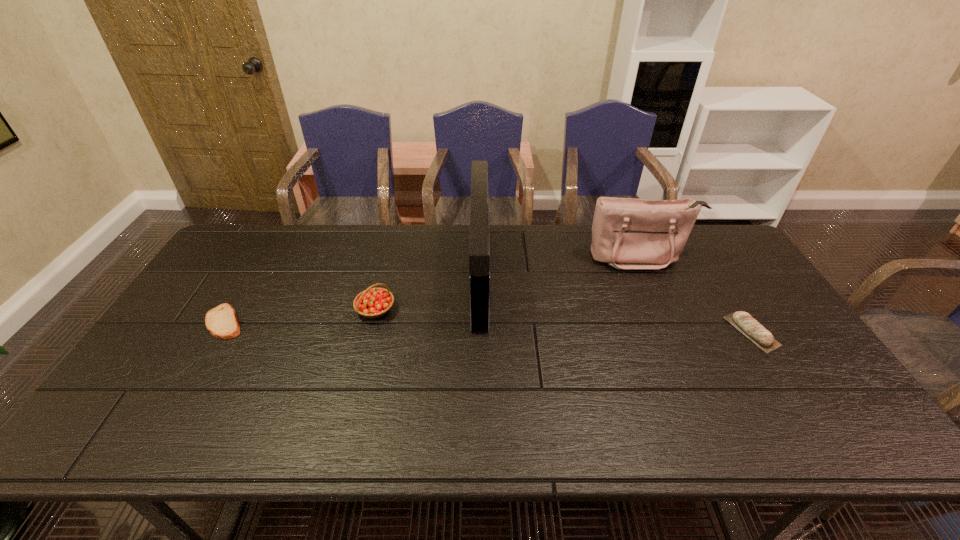
The image size is (960, 540). Identify the location of unoccupied area between the third object from right to left and the shoulder bag. (560, 266).

Where is `empty space that is in between the strawberry and the shortest object`? empty space that is in between the strawberry and the shortest object is located at coordinates (300, 316).

The image size is (960, 540). Identify the location of vacant area that lies between the right pita bread and the shoulder bag. (696, 294).

This screenshot has height=540, width=960. Identify the location of empty space between the fourth tallest object and the fourth shortest object. (696, 294).

I want to click on free point between the right pita bread and the fourth object from right to left, so click(564, 320).

Where is `free area in between the second tallest object and the third object from left to right`? free area in between the second tallest object and the third object from left to right is located at coordinates (560, 266).

Identify the location of vacant area that lies between the right pita bread and the shoulder bag. This screenshot has width=960, height=540. (696, 294).

I want to click on vacant area between the shortest object and the third object from right to left, so click(352, 299).

Locate which object ranks in proximity to the taller pita bread. Please provide its 2D coordinates. Your answer should be formatted as a tuple, i.e. [(x, y)], where the tuple contains the x and y coordinates of a point satisfying the conditions above.

[(627, 233)]

Locate an element on the screen. The image size is (960, 540). the fourth closest object to the right pita bread is located at coordinates (222, 322).